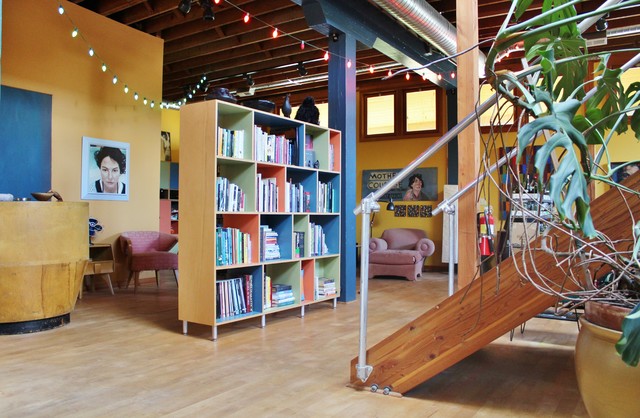
Locate an element on the screen. book shelf is located at coordinates (205, 178).